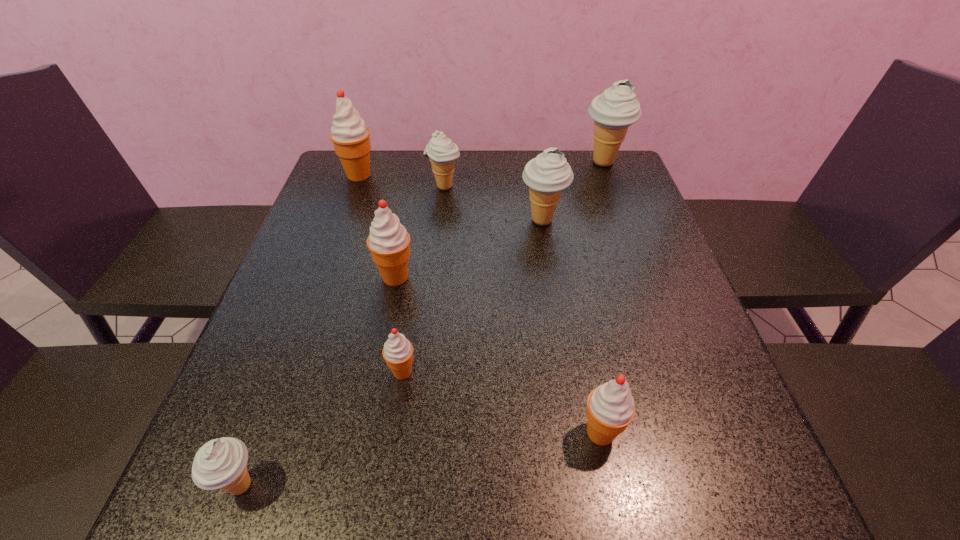
The image size is (960, 540). What are the coordinates of `the seventh farthest object` in the screenshot? It's located at (610, 409).

In order to click on the second nearest icecream in this screenshot , I will do `click(610, 409)`.

Where is `the third farthest red icecream`? Image resolution: width=960 pixels, height=540 pixels. the third farthest red icecream is located at coordinates pyautogui.click(x=398, y=351).

The width and height of the screenshot is (960, 540). In order to click on the third nearest icecream in this screenshot , I will do (398, 351).

The image size is (960, 540). Find the location of `the nearest beige icecream`. the nearest beige icecream is located at coordinates (221, 463).

Identify the location of the leftmost beige icecream. (221, 463).

At what (x,y) coordinates should I click in order to perform the action: click on vacant space located on the left of the rightmost object. Please return your answer as a coordinate pair (x, y). Looking at the image, I should click on (498, 163).

Where is `vacant space located on the right of the leftmost red icecream`? The width and height of the screenshot is (960, 540). vacant space located on the right of the leftmost red icecream is located at coordinates [x=445, y=175].

The width and height of the screenshot is (960, 540). What are the coordinates of `vacant region located 0.190m on the left of the fourth farthest icecream` in the screenshot? It's located at (445, 220).

The width and height of the screenshot is (960, 540). Identify the location of free space located on the left of the fourth nearest icecream. (340, 277).